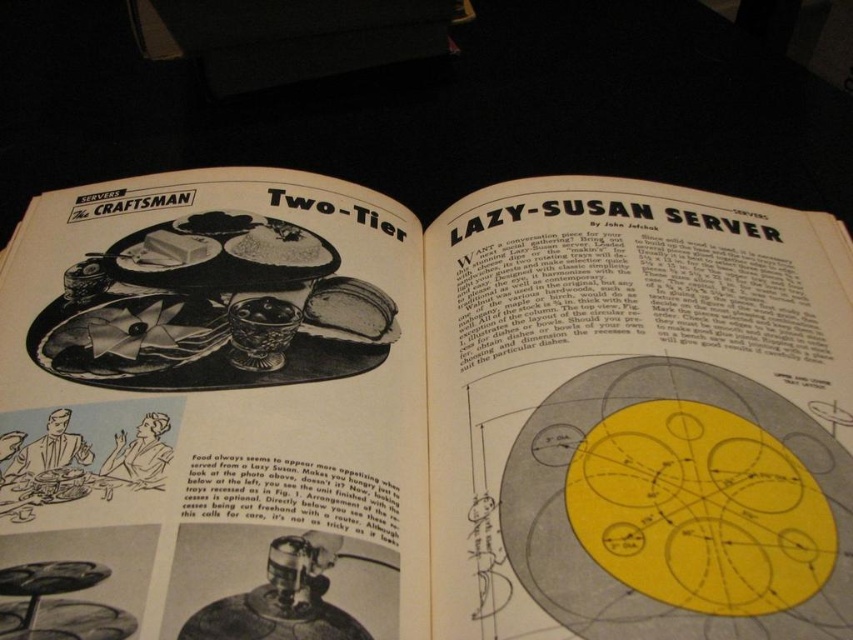
You are organizing a party and have both the yellow paper lazy susan server at upper right and the yellow paper circle at center. Which one can you stack items on top of without them falling over?

The yellow paper lazy susan server at upper right has a greater height compared to the yellow paper circle at center, so it can support stacking items without them falling over.

You are designing a layout for a magazine spread and need to place a yellow paper lazy susan server at upper right and a yellow paper circle at center. Based on the spatial arrangement in the provided image, which object should be positioned closer to the reader?

The yellow paper lazy susan server at upper right should be positioned closer to the reader because it is closer to the viewer than the yellow paper circle at center in the original image.